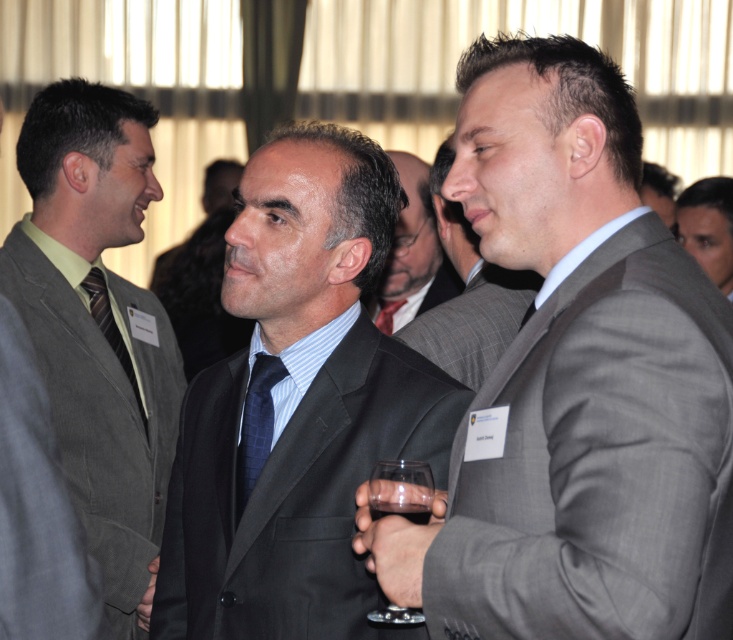
Can you confirm if transparent glass at center is shorter than gray suit at center?

Correct, transparent glass at center is not as tall as gray suit at center.

Looking at this image, can you confirm if transparent glass at center is taller than gray suit at center?

No.

Which is in front, point (380, 492) or point (674, 212)?

Point (380, 492)

The image size is (733, 640). I want to click on transparent glass at center, so click(x=401, y=490).

Is matte gray suit at center to the right of smooth gray suit at right from the viewer's perspective?

Incorrect, matte gray suit at center is not on the right side of smooth gray suit at right.

Who is higher up, matte gray suit at center or smooth gray suit at right?

smooth gray suit at right is above.

Locate an element on the screen. The image size is (733, 640). matte gray suit at center is located at coordinates (413, 253).

Who is positioned more to the right, gray textured suit at center or dark blue textured tie at center?

gray textured suit at center is more to the right.

Where is `gray textured suit at center`? The height and width of the screenshot is (640, 733). gray textured suit at center is located at coordinates (575, 381).

Identify the location of gray textured suit at center. (575, 381).